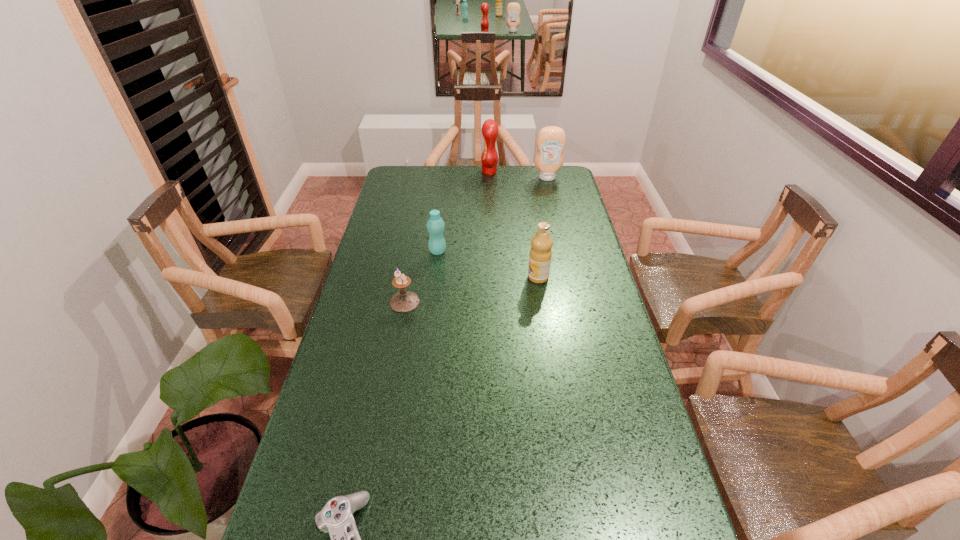
This screenshot has width=960, height=540. In order to click on vacant space at the left edge of the desktop in this screenshot , I will do `click(341, 341)`.

In order to click on vacant area at the right edge of the desktop in this screenshot , I will do `click(550, 207)`.

Locate an element on the screen. The image size is (960, 540). vacant area that lies between the second nearest object and the third object from right to left is located at coordinates (447, 237).

In order to click on free space between the third nearest object and the second shortest object in this screenshot , I will do `click(471, 289)`.

Image resolution: width=960 pixels, height=540 pixels. I want to click on unoccupied position between the candle holder and the fourth object from left to right, so click(447, 237).

Where is `free space that is in between the candle holder and the fourth object from left to right`? free space that is in between the candle holder and the fourth object from left to right is located at coordinates (447, 237).

Where is `free space between the fifth tallest object and the fifth object from left to right`? Image resolution: width=960 pixels, height=540 pixels. free space between the fifth tallest object and the fifth object from left to right is located at coordinates (471, 289).

Identify the location of vacant space that's between the third object from right to left and the right condiment. The height and width of the screenshot is (540, 960). pos(518,175).

Locate an element on the screen. free space between the fourth nearest object and the fourth object from left to right is located at coordinates (464, 212).

At what (x,y) coordinates should I click in order to perform the action: click on free space between the fifth tallest object and the fourth object from left to right. Please return your answer as a coordinate pair (x, y). This screenshot has height=540, width=960. Looking at the image, I should click on coord(447,237).